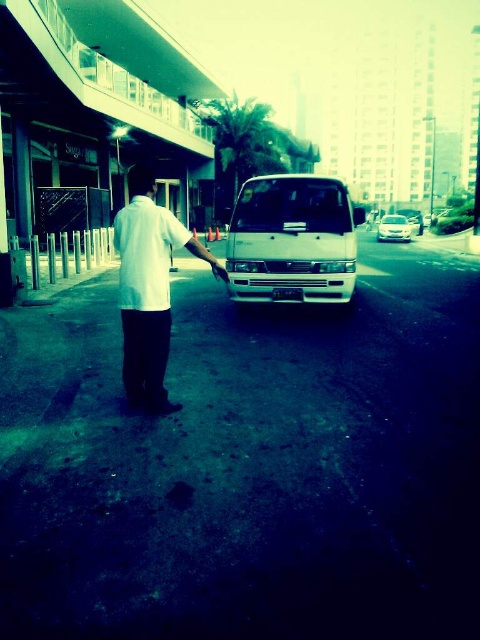
Question: Does white cotton shirt at center have a lesser width compared to metallic silver van at center?

Choices:
 (A) yes
 (B) no

Answer: (A)

Question: Which of the following is the farthest from the observer?

Choices:
 (A) white matte van at center
 (B) metallic silver van at center
 (C) white matte shirt at center
 (D) white cotton shirt at center

Answer: (B)

Question: Which of the following is the farthest from the observer?

Choices:
 (A) white cotton shirt at center
 (B) white matte shirt at center
 (C) metallic silver van at center
 (D) white matte van at center

Answer: (C)

Question: Does white cotton shirt at center appear over metallic silver van at center?

Choices:
 (A) no
 (B) yes

Answer: (A)

Question: Is white cotton shirt at center above metallic silver van at center?

Choices:
 (A) no
 (B) yes

Answer: (A)

Question: Which point is closer to the camera?

Choices:
 (A) (292, 200)
 (B) (143, 330)
 (C) (392, 225)

Answer: (B)